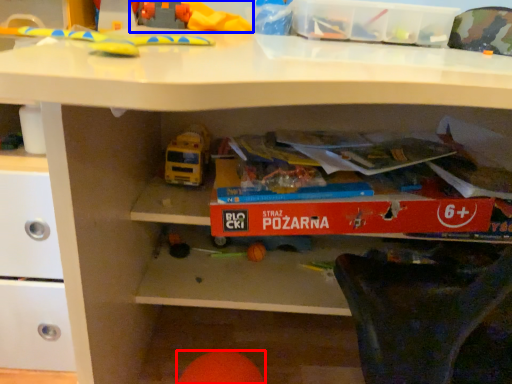
Question: Which object is closer to the camera taking this photo, toy (highlighted by a red box) or toy (highlighted by a blue box)?

Choices:
 (A) toy
 (B) toy

Answer: (A)